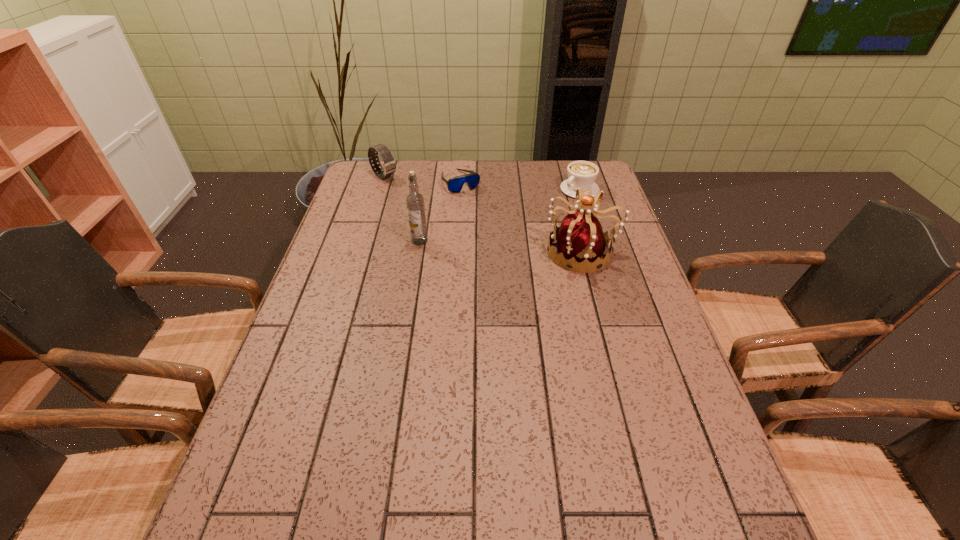
What are the coordinates of `free space at the far edge of the desktop` in the screenshot? It's located at (449, 160).

In order to click on vacant space at the near edge in this screenshot , I will do `click(614, 465)`.

The width and height of the screenshot is (960, 540). In the image, there is a desktop. Find the location of `free region at the left edge`. free region at the left edge is located at coordinates (351, 276).

Where is `vacant area at the right edge`? This screenshot has height=540, width=960. vacant area at the right edge is located at coordinates (628, 415).

The image size is (960, 540). Identify the location of free space at the far right corner. (565, 163).

Locate an element on the screen. free space between the second object from left to right and the second shortest object is located at coordinates (x=499, y=215).

This screenshot has width=960, height=540. Find the location of `empty location between the watch and the tiara`. empty location between the watch and the tiara is located at coordinates (483, 214).

The width and height of the screenshot is (960, 540). In order to click on unoccupied area between the tiara and the watch in this screenshot , I will do `click(483, 214)`.

Where is `free space between the tiara and the shortest object`? free space between the tiara and the shortest object is located at coordinates (521, 217).

This screenshot has width=960, height=540. I want to click on blank region between the third object from right to left and the leftmost object, so click(x=422, y=179).